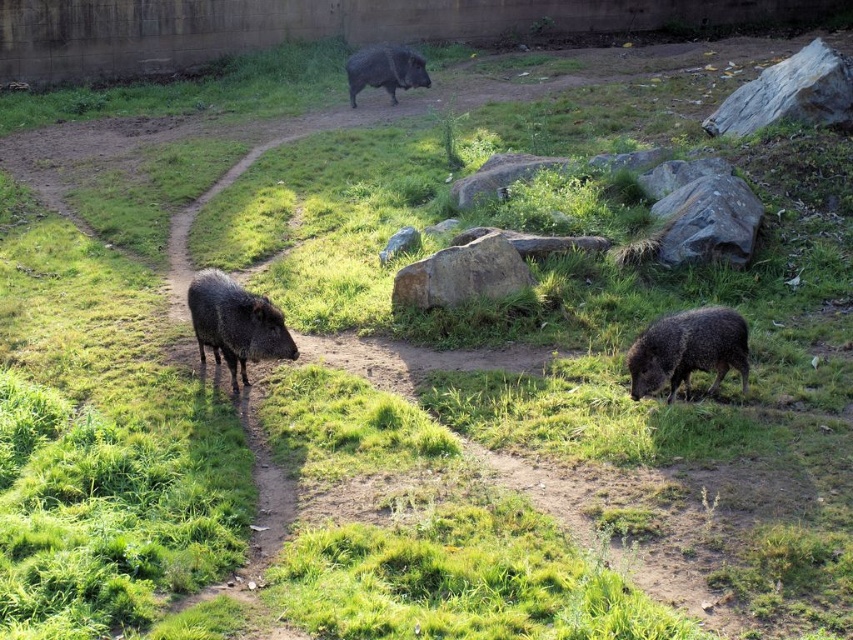
Question: Does dark gray spiny at center appear on the left side of dark gray textured pig at upper center?

Choices:
 (A) yes
 (B) no

Answer: (A)

Question: Which point is farther from the camera taking this photo?

Choices:
 (A) (720, 333)
 (B) (289, 356)

Answer: (B)

Question: Considering the real-world distances, which object is closest to the dark gray spiny at lower right?

Choices:
 (A) dark gray textured pig at upper center
 (B) dark gray spiny at center

Answer: (B)

Question: Considering the relative positions of dark gray spiny at center and dark gray textured pig at upper center in the image provided, where is dark gray spiny at center located with respect to dark gray textured pig at upper center?

Choices:
 (A) above
 (B) below

Answer: (B)

Question: Which point is closer to the camera taking this photo?

Choices:
 (A) (374, 81)
 (B) (239, 294)

Answer: (B)

Question: Is dark gray spiny at lower right thinner than dark gray spiny at center?

Choices:
 (A) no
 (B) yes

Answer: (B)